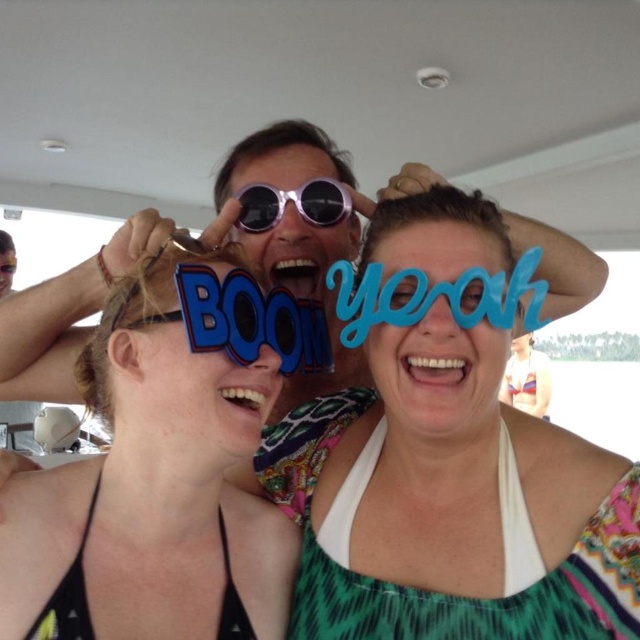
Question: Which of the following is the closest to the observer?

Choices:
 (A) (212, 618)
 (B) (269, 224)

Answer: (A)

Question: Which object appears closest to the camera in this image?

Choices:
 (A) matte plastic sunglasses at center
 (B) sunglasses at center
 (C) blue paper sign at center

Answer: (C)

Question: Does matte plastic sunglasses at center appear over sunglasses at center?

Choices:
 (A) no
 (B) yes

Answer: (A)

Question: Is blue paper sign at center positioned behind sunglasses at center?

Choices:
 (A) yes
 (B) no

Answer: (B)

Question: Does matte plastic sunglasses at center appear on the left side of sunglasses at center?

Choices:
 (A) no
 (B) yes

Answer: (B)

Question: Which point is closer to the camera taking this photo?

Choices:
 (A) (336, 621)
 (B) (20, 500)
 (C) (262, 205)

Answer: (A)